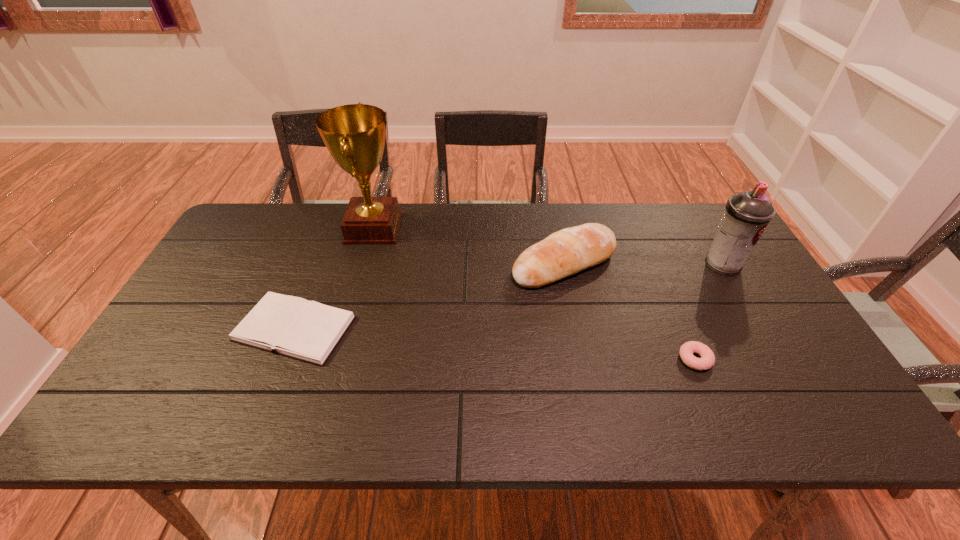
Locate an element on the screen. This screenshot has height=540, width=960. free space located 0.050m on the front of the hardback book is located at coordinates (273, 385).

This screenshot has height=540, width=960. Identify the location of vacant space located on the back of the fourth object from left to right. (648, 248).

Find the location of a particular element. award that is at the far edge is located at coordinates (354, 134).

Locate an element on the screen. bread that is positioned at the far edge is located at coordinates (563, 253).

I want to click on object that is at the right edge, so click(x=747, y=214).

In the image, there is a desktop. Where is `vacant region at the far edge`? vacant region at the far edge is located at coordinates (340, 224).

This screenshot has height=540, width=960. Identify the location of vacant region at the near edge of the desktop. (612, 429).

Where is `vacant space at the left edge of the desktop`? vacant space at the left edge of the desktop is located at coordinates (227, 317).

Where is `vacant space at the right edge of the desktop`? This screenshot has width=960, height=540. vacant space at the right edge of the desktop is located at coordinates [737, 307].

This screenshot has height=540, width=960. I want to click on empty location between the aerosol can and the hardback book, so click(509, 296).